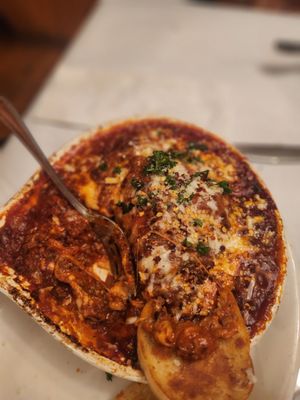
What are the coordinates of `placemat` in the screenshot? It's located at (276, 177).